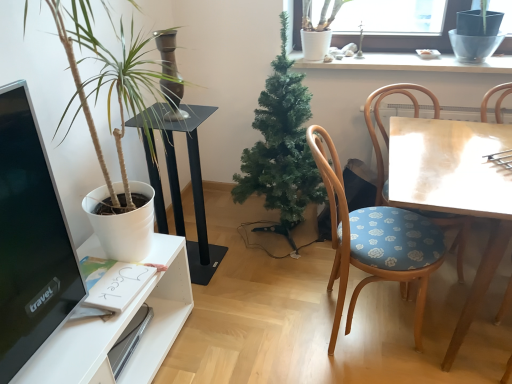
Question: In terms of height, does black glossy computer monitor at left look taller or shorter compared to wooden chair with floral cushion at right, placed as the first chair when sorted from right to left?

Choices:
 (A) tall
 (B) short

Answer: (B)

Question: In terms of size, does black glossy computer monitor at left appear bigger or smaller than wooden chair with floral cushion at right, placed as the second chair when sorted from left to right?

Choices:
 (A) big
 (B) small

Answer: (B)

Question: Based on their relative distances, which object is farther from the wooden chair with blue floral cushion at right, arranged as the second chair when viewed from the right?

Choices:
 (A) black glossy computer monitor at left
 (B) green artificial tree at center, which is counted as the 1th houseplant, starting from the right
 (C) wooden table at right
 (D) white matte plant at left, the 1th houseplant in the left-to-right sequence
 (E) wooden chair with floral cushion at right, placed as the first chair when sorted from right to left

Answer: (A)

Question: Estimate the real-world distances between objects in this image. Which object is closer to the wooden chair with blue floral cushion at right, arranged as the second chair when viewed from the right?

Choices:
 (A) black glass table at center
 (B) wooden chair with floral cushion at right, placed as the second chair when sorted from left to right
 (C) clear glass window at upper center
 (D) black glossy computer monitor at left
 (E) wooden table at right

Answer: (E)